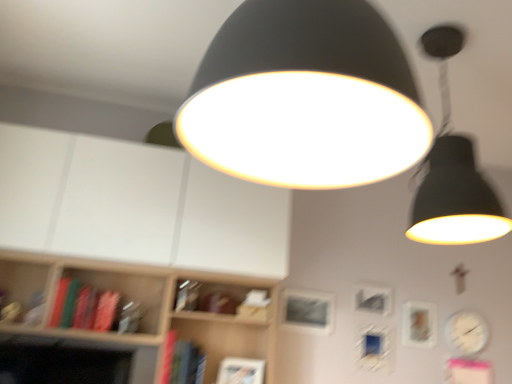
Question: Looking at their shapes, would you say metallic silver picture frame at center, which is counted as the 2th picture frame, starting from the right, is wider or thinner than green matte book at left, which ranks as the 2th book in right-to-left order?

Choices:
 (A) thin
 (B) wide

Answer: (A)

Question: Do you think metallic silver picture frame at center, which is counted as the 2th picture frame, starting from the right, is within green matte book at left, arranged as the 2th book when ordered from the bottom, or outside of it?

Choices:
 (A) inside
 (B) outside

Answer: (B)

Question: Based on their relative distances, which object is nearer to the white glossy clock at lower right?

Choices:
 (A) green matte book at left, positioned as the first book in left-to-right order
 (B) hardcover book at lower center, positioned as the second book in top-to-bottom order
 (C) matte silver picture frame at right, which is the third picture frame from left to right
 (D) metallic silver picture frame at center, which is counted as the 2th picture frame, starting from the left
 (E) matte black lampshade at center, which is the 1th lamp in front-to-back order

Answer: (C)

Question: Estimate the real-world distances between objects in this image. Which object is closer to the white glossy clock at lower right?

Choices:
 (A) matte black lampshade at upper right, arranged as the first lamp when viewed from the back
 (B) metallic silver picture frame at center, arranged as the 1th picture frame when viewed from the left
 (C) green matte book at left, positioned as the first book in left-to-right order
 (D) matte black lampshade at center, which is the 2th lamp in back-to-front order
 (E) metallic silver picture frame at center, which is counted as the 2th picture frame, starting from the left

Answer: (E)